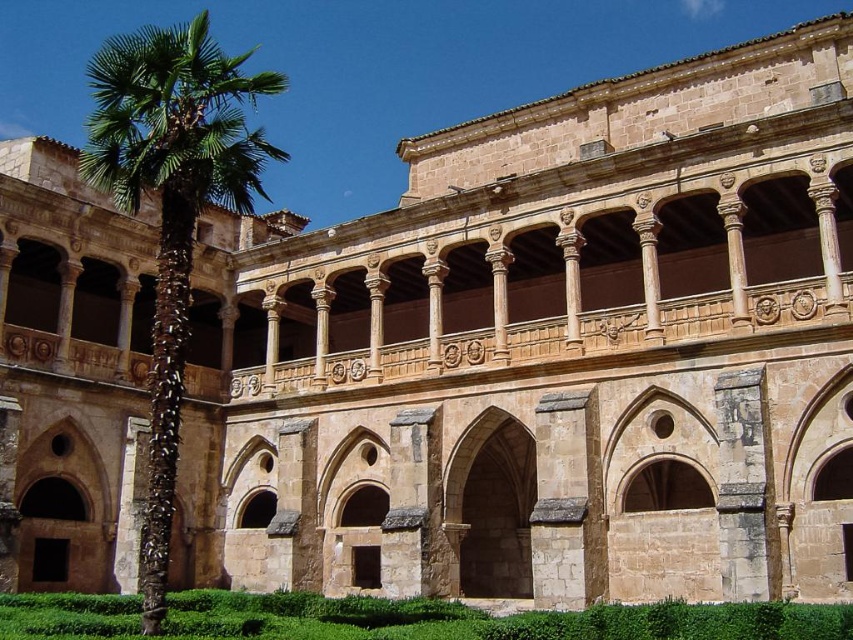
Who is more distant from viewer, (103, 67) or (641, 612)?

The point (103, 67) is behind.

Which is behind, point (155, 596) or point (265, 600)?

Point (265, 600)

You are a GUI agent. You are given a task and a screenshot of the screen. Output one action in this format:
    pyautogui.click(x=<x>, y=<y>)
    Task: Click on the green leafy palm at left
    This screenshot has height=640, width=853.
    Given the screenshot: What is the action you would take?
    pyautogui.click(x=172, y=209)